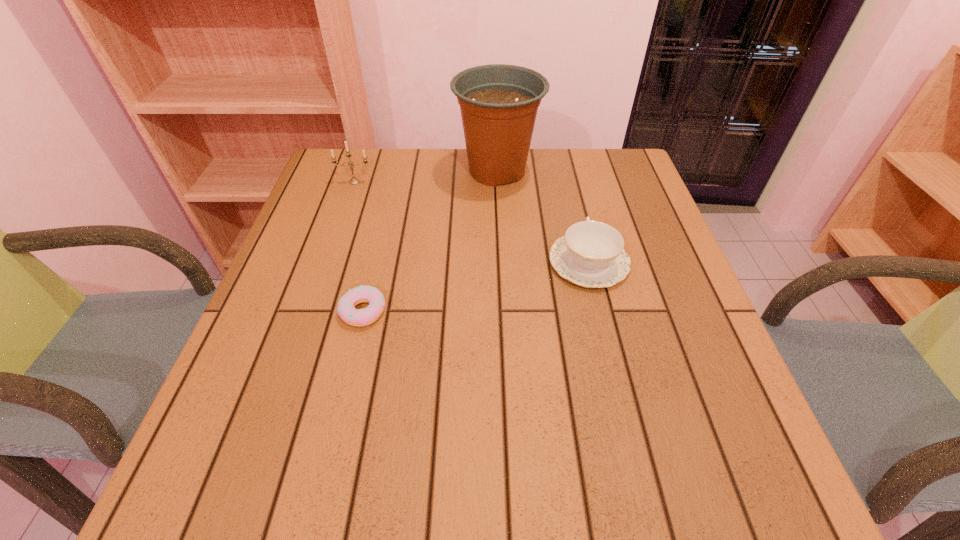
I want to click on the tallest object, so click(x=498, y=102).

Identify the location of candle. The height and width of the screenshot is (540, 960). (354, 181).

Image resolution: width=960 pixels, height=540 pixels. I want to click on the second tallest object, so click(x=354, y=181).

Identify the location of the third tallest object. (590, 254).

The image size is (960, 540). I want to click on the second nearest object, so click(590, 254).

Identify the location of the third object from right to left. The image size is (960, 540). (346, 310).

Where is `doughnut`? doughnut is located at coordinates (346, 310).

Where is `free spot located on the right of the flowerpot`? The height and width of the screenshot is (540, 960). free spot located on the right of the flowerpot is located at coordinates (632, 171).

You are a GUI agent. You are given a task and a screenshot of the screen. Output one action in this format:
    pyautogui.click(x=<x>, y=<y>)
    Task: Click on the vacant point located on the right of the third shortest object
    
    Given the screenshot: What is the action you would take?
    pyautogui.click(x=402, y=182)

Identify the location of vacant region located 0.190m on the handle side of the second shortest object. (571, 191).